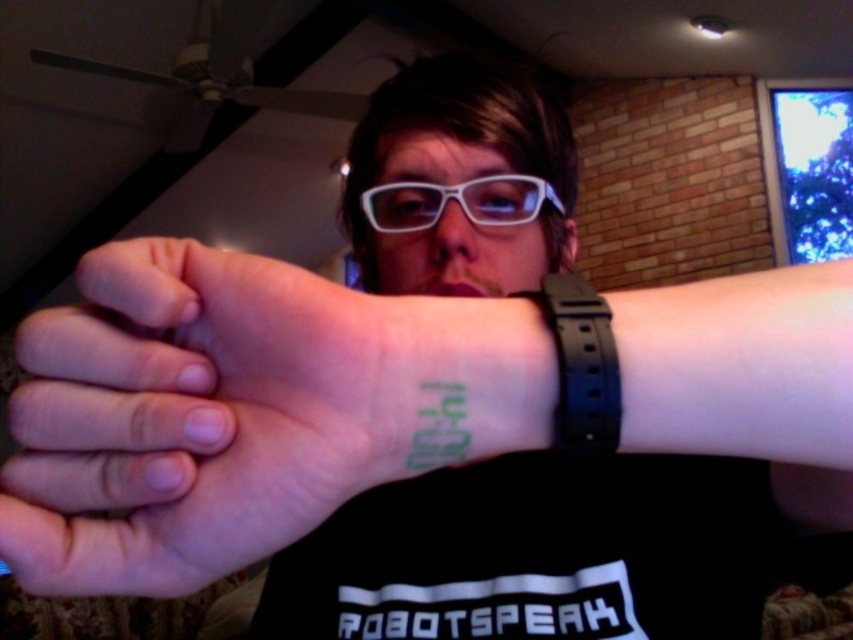
Question: Where is green ink tattoo at center located in relation to black rubber wristband at upper right in the image?

Choices:
 (A) left
 (B) right

Answer: (A)

Question: Which point is closer to the camera?

Choices:
 (A) green ink tattoo at center
 (B) black rubber wristband at upper right

Answer: (A)

Question: Can you confirm if green ink tattoo at center is positioned to the right of black rubber wristband at upper right?

Choices:
 (A) yes
 (B) no

Answer: (B)

Question: Can you confirm if black rubber wristband at upper right is positioned to the right of white matte glasses at center?

Choices:
 (A) no
 (B) yes

Answer: (B)

Question: Based on their relative distances, which object is nearer to the white matte glasses at center?

Choices:
 (A) green ink tattoo at center
 (B) black rubber wristband at upper right

Answer: (B)

Question: Which of the following is the farthest from the observer?

Choices:
 (A) black rubber wristband at upper right
 (B) green ink tattoo at center
 (C) white matte glasses at center

Answer: (C)